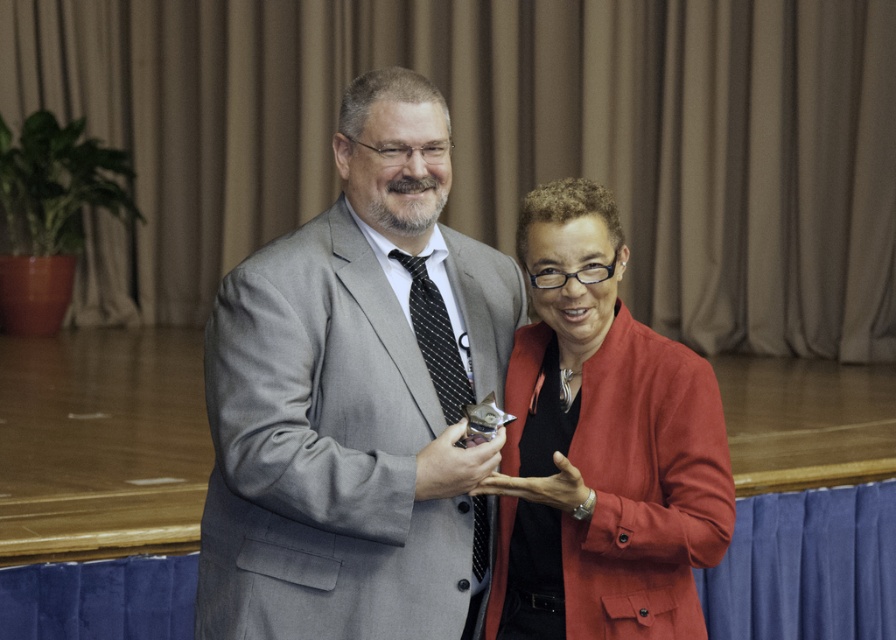
Is gray suit at center positioned behind matte red blazer at center?

That is False.

Is point (505, 288) in front of point (599, 211)?

No, it is behind (599, 211).

This screenshot has width=896, height=640. In order to click on gray suit at center in this screenshot , I will do `click(356, 397)`.